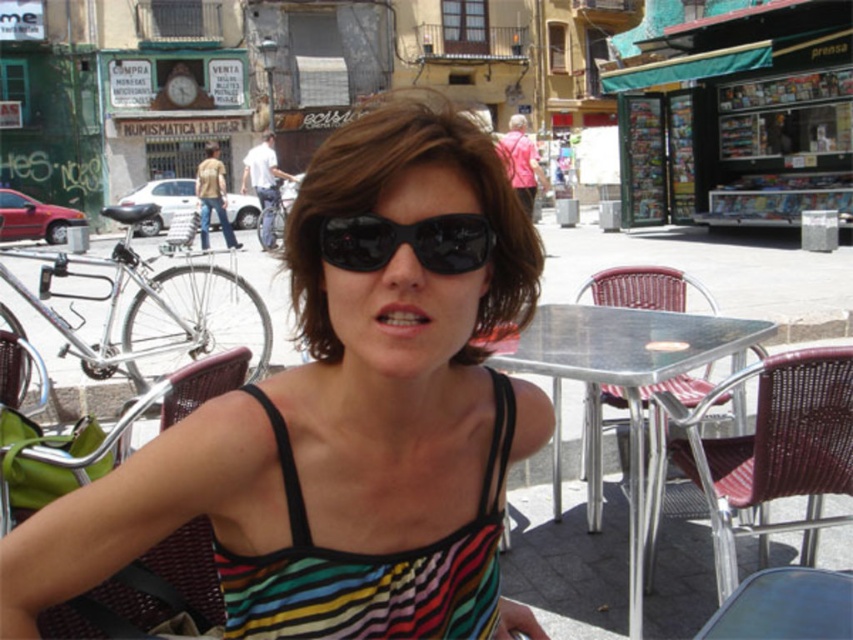
Based on the photo, you are a photographer standing in the scene and want to take a photo of the woven brown chair at lower right and the metallic silver table at center. Which object should you focus on first if you want to capture both in sharp focus?

You should focus on the woven brown chair at lower right first because it is closer to the viewer than the metallic silver table at center, so adjusting focus from near to far will help both objects be in sharp focus.

You are a photographer trying to capture the striped fabric dress at center and the metallic silver table at center in the same frame. Which object should you focus on first if you want to ensure both are in focus without adjusting your camera settings?

The metallic silver table at center is larger than the striped fabric dress at center, so focusing on the metallic silver table at center first would help ensure both are in focus since it occupies more of the frame.